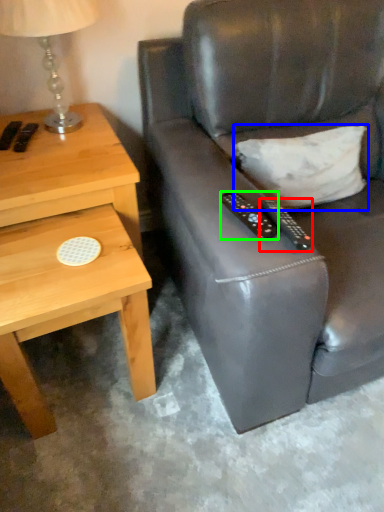
Question: Estimate the real-world distances between objects in this image. Which object is farther from remote control (highlighted by a red box), pillow (highlighted by a blue box) or remote control (highlighted by a green box)?

Choices:
 (A) pillow
 (B) remote control

Answer: (A)